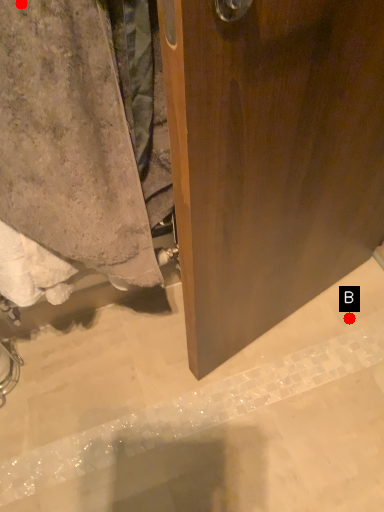
Question: Two points are circled on the image, labeled by A and B beside each circle. Among these points, which one is farthest from the camera?

Choices:
 (A) A is further
 (B) B is further

Answer: (B)